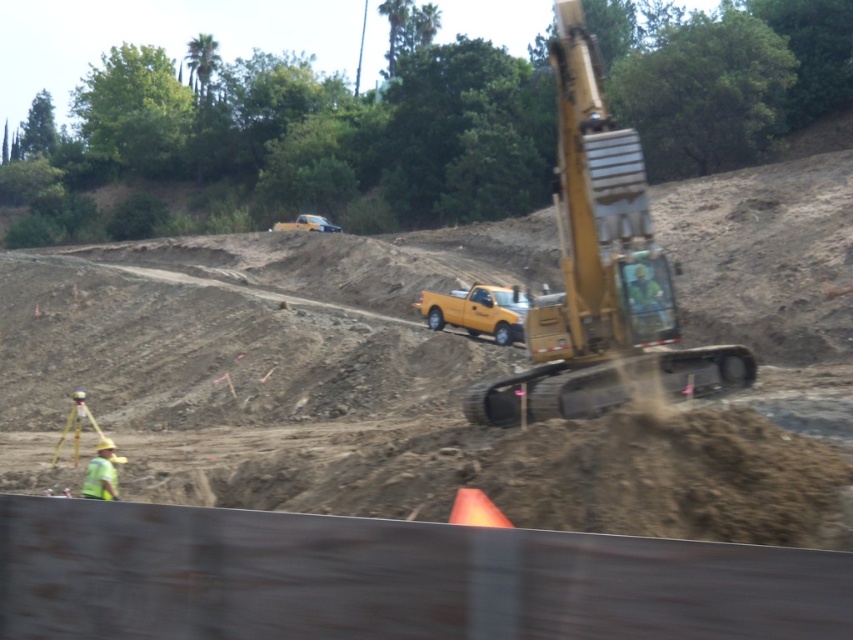
Question: Among these objects, which one is farthest from the camera?

Choices:
 (A) yellow hard hat at lower left
 (B) yellow metallic excavator at right

Answer: (B)

Question: Does yellow metallic excavator at right appear under yellow hard hat at lower left?

Choices:
 (A) yes
 (B) no

Answer: (B)

Question: From the image, what is the correct spatial relationship of yellow metallic excavator at right in relation to yellow hard hat at lower left?

Choices:
 (A) above
 (B) below

Answer: (A)

Question: Which point is closer to the camera?

Choices:
 (A) (96, 456)
 (B) (514, 410)

Answer: (B)

Question: Does yellow metallic excavator at right have a larger size compared to yellow hard hat at lower left?

Choices:
 (A) no
 (B) yes

Answer: (B)